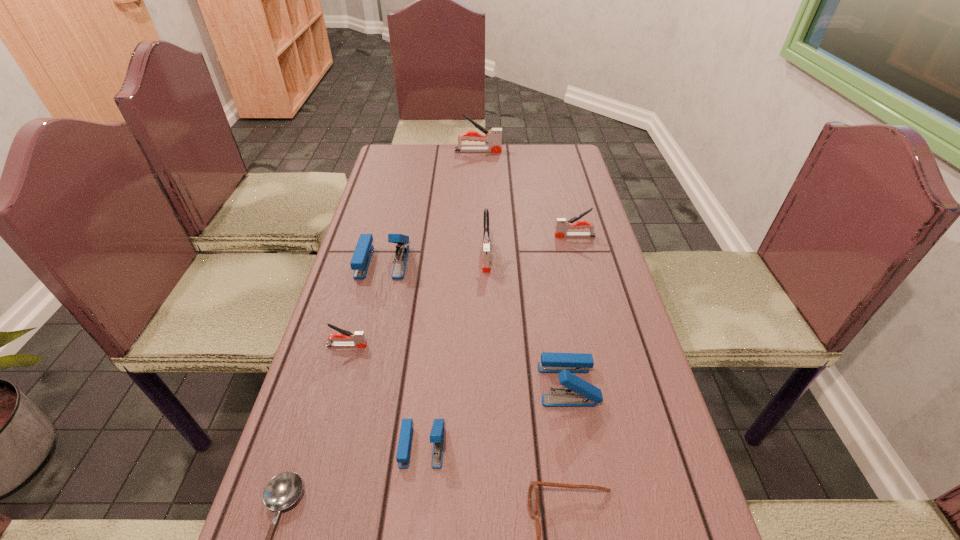
Identify the location of the closest blue stapler to the biggest blue stapler. (437, 432).

Image resolution: width=960 pixels, height=540 pixels. I want to click on vacant point that satisfies the following two spatial constraints: 1. on the handle side of the third smallest gray stapler; 2. on the handle side of the leftmost gray stapler, so click(x=488, y=346).

The height and width of the screenshot is (540, 960). What are the coordinates of `blank space that satisfies the following two spatial constraints: 1. on the handle side of the farthest gray stapler; 2. on the back side of the sixth farthest object` in the screenshot? It's located at (476, 384).